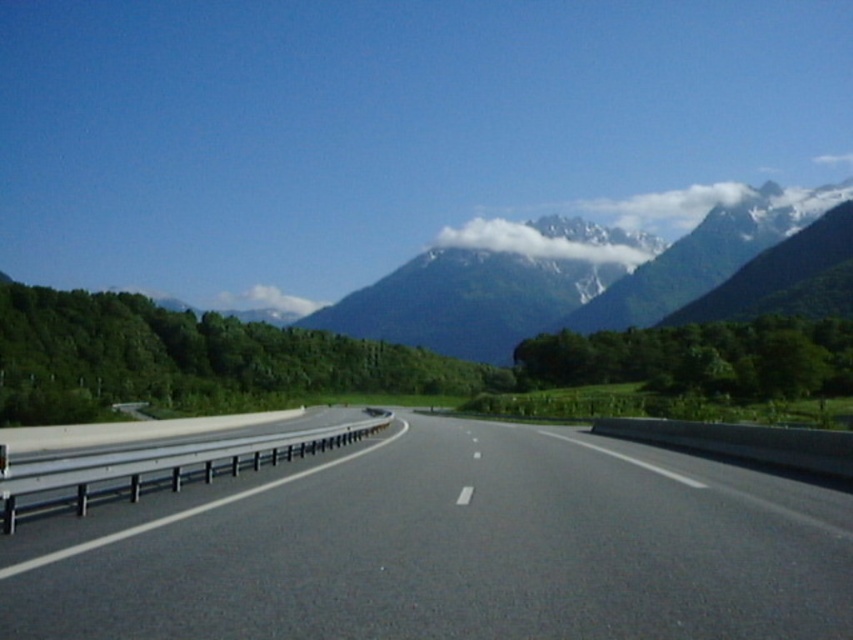
Is white fluffy cloud at center smaller than white fluffy cloud at upper center?

No, white fluffy cloud at center is not smaller than white fluffy cloud at upper center.

Who is higher up, white fluffy cloud at center or white fluffy cloud at upper center?

white fluffy cloud at center is higher up.

Which is behind, point (511, 228) or point (277, 317)?

The point (511, 228) is behind.

Image resolution: width=853 pixels, height=640 pixels. Find the location of `white fluffy cloud at center`. white fluffy cloud at center is located at coordinates (553, 241).

In the scene shown: Who is shorter, black asphalt highway at center or white fluffy cloud at upper center?

black asphalt highway at center is shorter.

Describe the element at coordinates (448, 548) in the screenshot. The image size is (853, 640). I see `black asphalt highway at center` at that location.

Locate an element on the screen. Image resolution: width=853 pixels, height=640 pixels. black asphalt highway at center is located at coordinates (448, 548).

Does black asphalt highway at center appear on the left side of white fluffy cloud at center?

Yes, black asphalt highway at center is to the left of white fluffy cloud at center.

Between black asphalt highway at center and white fluffy cloud at center, which one has less height?

black asphalt highway at center

The height and width of the screenshot is (640, 853). What do you see at coordinates (448, 548) in the screenshot? I see `black asphalt highway at center` at bounding box center [448, 548].

I want to click on black asphalt highway at center, so click(448, 548).